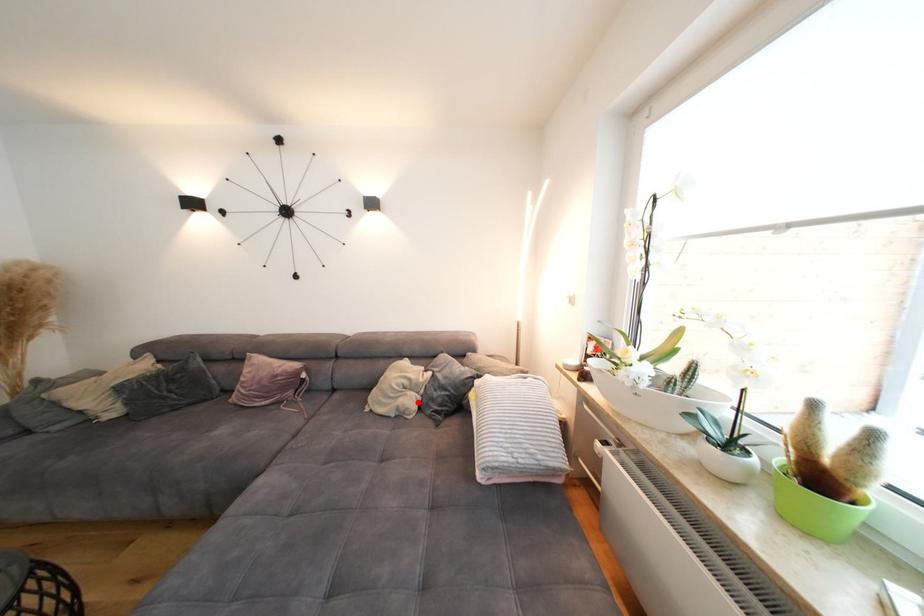
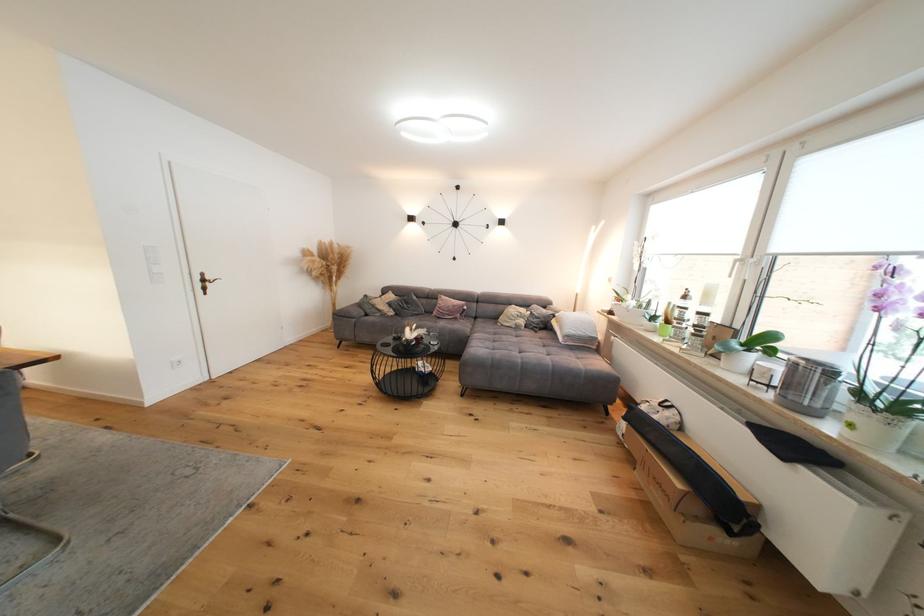
Question: I am providing you with two images of the same scene from different viewpoints. A red point is shown in image1. For the corresponding object point in image2, is it positioned nearer or farther from the camera?

Choices:
 (A) Nearer
 (B) Farther

Answer: (A)